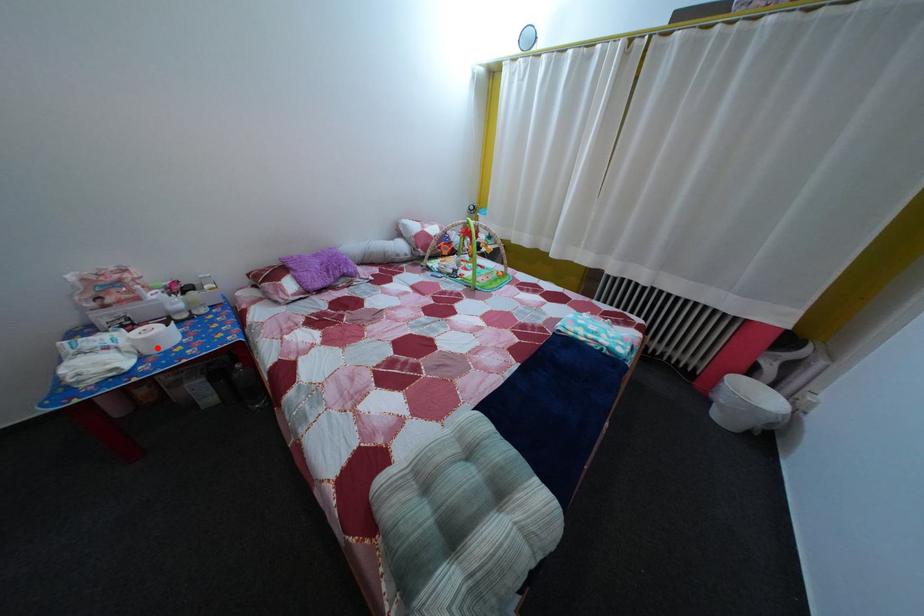
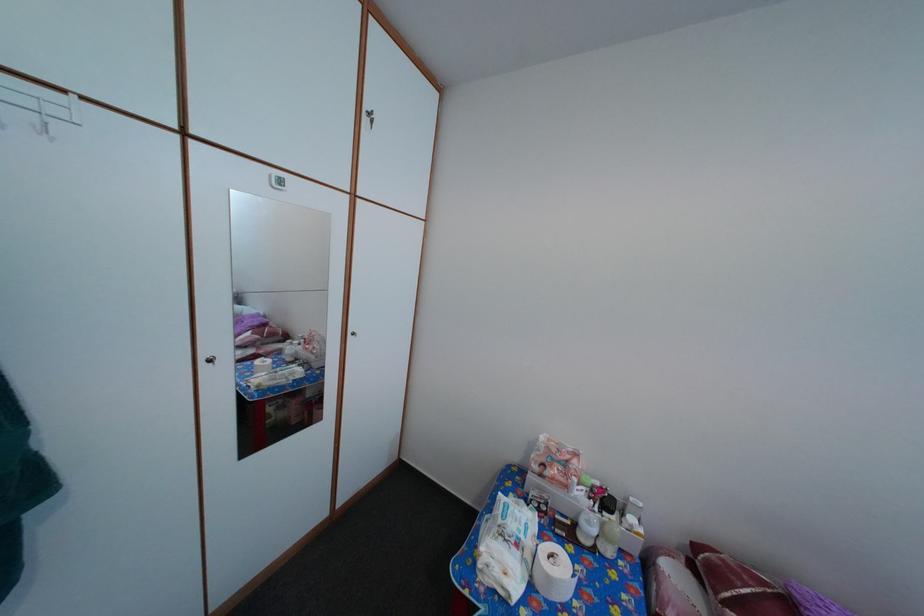
In the second image, find the point that corresponds to the highlighted location in the first image.

(558, 586)